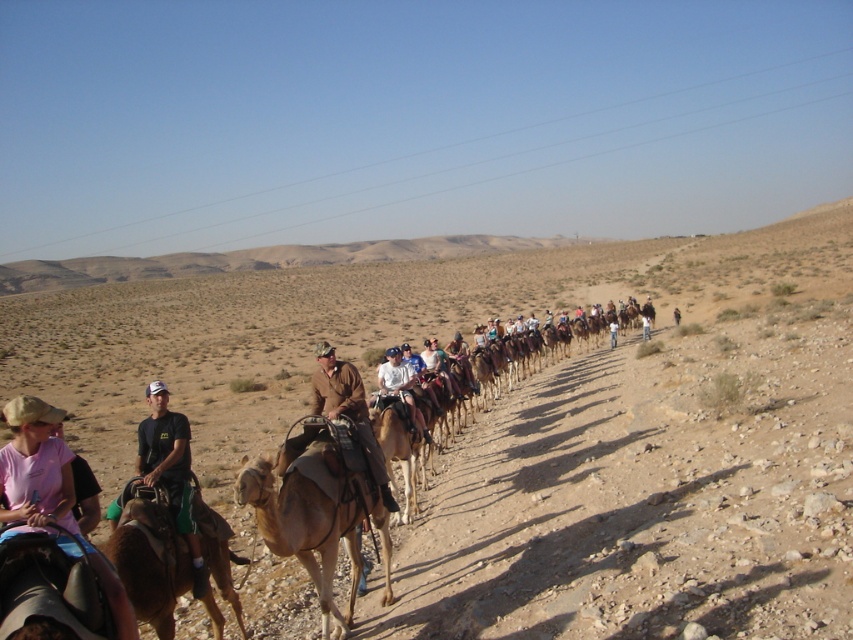
Which of these two, pink fabric cap at lower left or brown suede jacket at center, stands shorter?

pink fabric cap at lower left is shorter.

Is point (62, 490) closer to viewer compared to point (383, 467)?

Yes, it is in front of point (383, 467).

Locate an element on the screen. pink fabric cap at lower left is located at coordinates (35, 468).

This screenshot has width=853, height=640. I want to click on pink fabric cap at lower left, so click(35, 468).

The height and width of the screenshot is (640, 853). What are the coordinates of `brown sandy desert at center` in the screenshot? It's located at (526, 424).

Does brown sandy desert at center lie behind pink fabric cap at lower left?

Yes.

What do you see at coordinates (526, 424) in the screenshot? The height and width of the screenshot is (640, 853). I see `brown sandy desert at center` at bounding box center [526, 424].

Where is `brown sandy desert at center`? The height and width of the screenshot is (640, 853). brown sandy desert at center is located at coordinates (526, 424).

Can you confirm if light brown leather camel at center is wider than dark green fabric shirt at left?

Incorrect, light brown leather camel at center's width does not surpass dark green fabric shirt at left's.

Consider the image. Is light brown leather camel at center bigger than dark green fabric shirt at left?

Indeed, light brown leather camel at center has a larger size compared to dark green fabric shirt at left.

Between point (305, 556) and point (173, 506), which one is positioned behind?

Point (305, 556)

Locate an element on the screen. light brown leather camel at center is located at coordinates (314, 520).